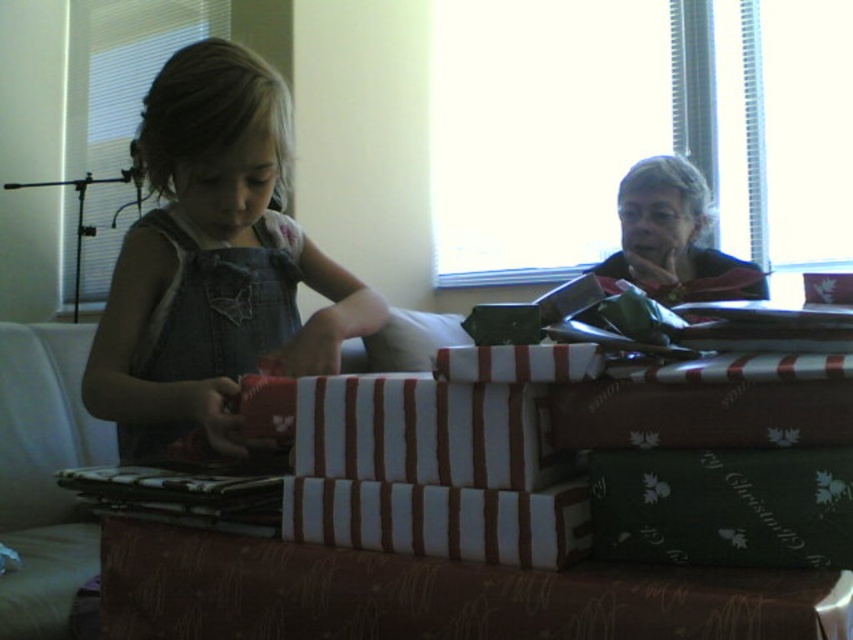
Between denim overalls at center and matte denim dress at left, which one appears on the right side from the viewer's perspective?

Positioned to the right is denim overalls at center.

Image resolution: width=853 pixels, height=640 pixels. What do you see at coordinates (213, 262) in the screenshot?
I see `denim overalls at center` at bounding box center [213, 262].

This screenshot has height=640, width=853. I want to click on denim overalls at center, so click(213, 262).